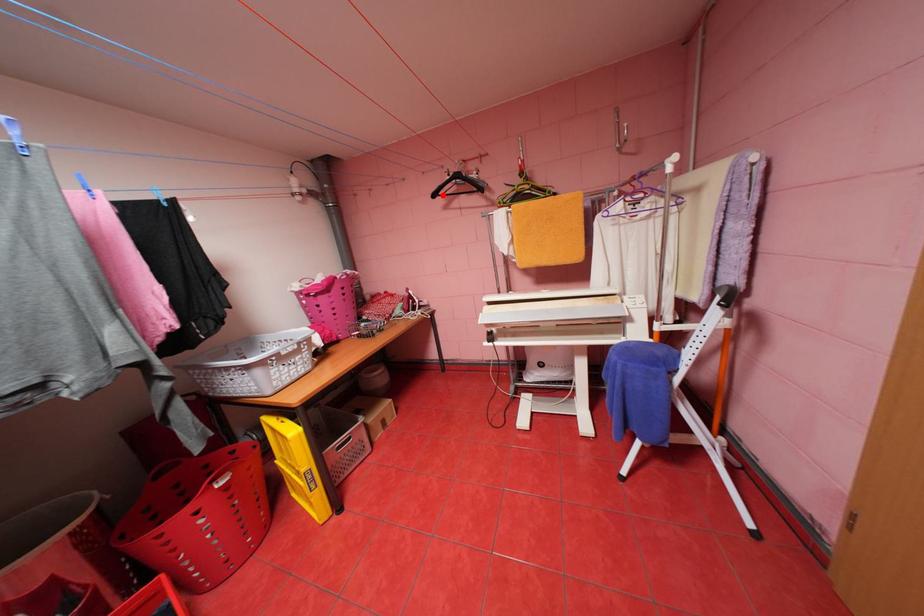
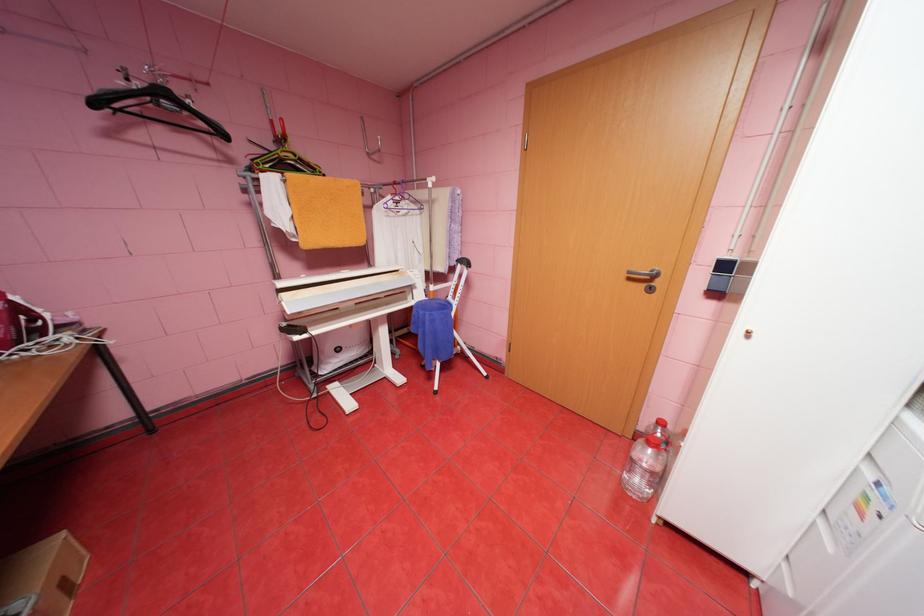
Question: I am providing you with two images of the same scene from different viewpoints. Image1 has a red point marked. In image2, the corresponding 3D location appears at what relative position? Reply with the corresponding letter.

Choices:
 (A) Closer
 (B) Farther

Answer: (B)